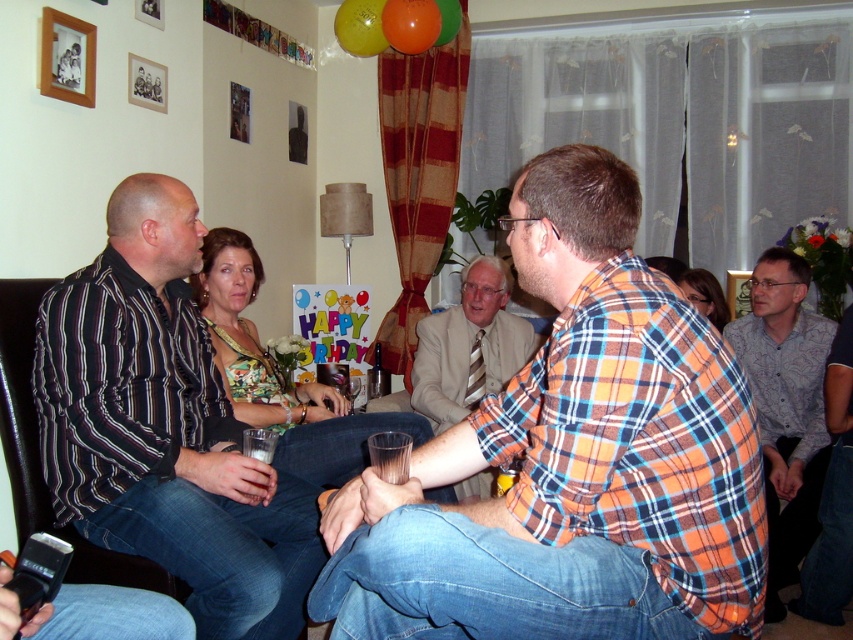
From the picture: Which of these two, orange plaid shirt at center or floral fabric dress at center, stands taller?

orange plaid shirt at center

Who is more forward, (675, 547) or (715, 321)?

Positioned in front is point (675, 547).

The height and width of the screenshot is (640, 853). Identify the location of orange plaid shirt at center. (572, 460).

Is gray cotton shirt at right smaller than floral fabric dress at center?

No, gray cotton shirt at right is not smaller than floral fabric dress at center.

Does point (770, 300) come farther from viewer compared to point (700, 305)?

No, it is not.

What are the coordinates of `gray cotton shirt at right` in the screenshot? It's located at (785, 406).

Can you confirm if striped cotton shirt at left is taller than floral print blouse at center?

Indeed, striped cotton shirt at left has a greater height compared to floral print blouse at center.

Who is shorter, striped cotton shirt at left or floral print blouse at center?

floral print blouse at center is shorter.

Between point (183, 332) and point (241, 342), which one is positioned in front?

Point (183, 332) is in front.

Find the location of a particular element. The height and width of the screenshot is (640, 853). striped cotton shirt at left is located at coordinates (164, 428).